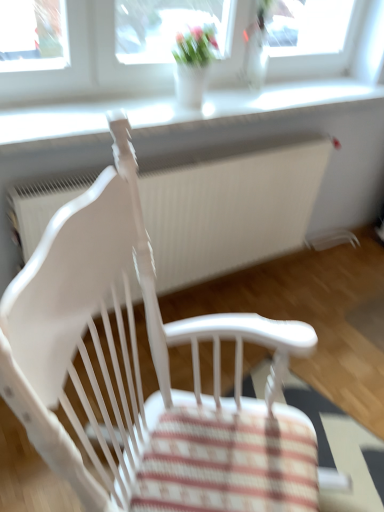
Question: Is white wood chair at center to the left or to the right of white plastic window sill at upper center in the image?

Choices:
 (A) left
 (B) right

Answer: (A)

Question: From a real-world perspective, is white wood chair at center positioned above or below white plastic window sill at upper center?

Choices:
 (A) above
 (B) below

Answer: (B)

Question: Which object is positioned closest to the white plastic window sill at upper center?

Choices:
 (A) white wood chair at center
 (B) white textured radiator at center

Answer: (B)

Question: Which object is the farthest from the white textured radiator at center?

Choices:
 (A) white wood chair at center
 (B) white plastic window sill at upper center

Answer: (A)